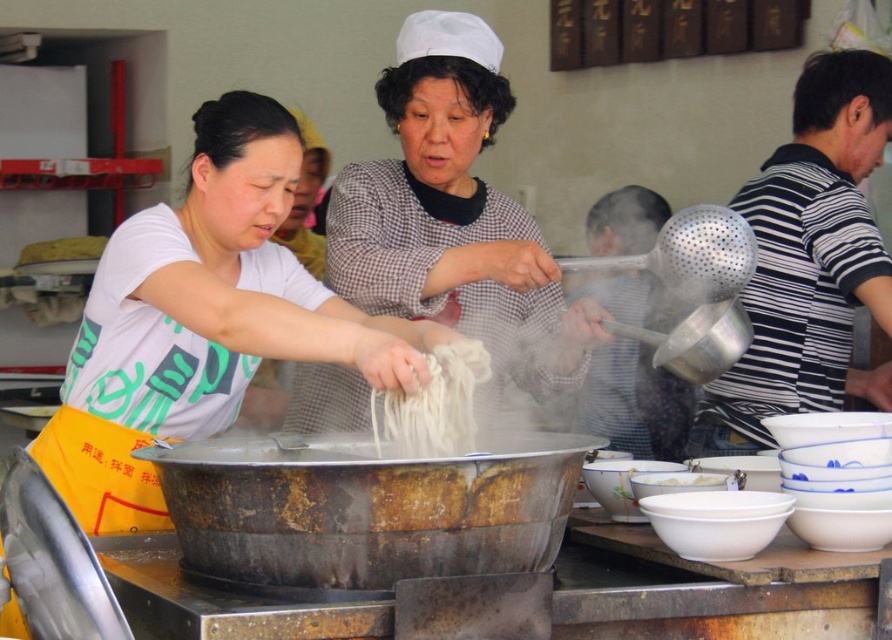
Question: Can you confirm if rusty metal wok at center is smaller than white matte noodles at center?

Choices:
 (A) no
 (B) yes

Answer: (A)

Question: Which of the following is the farthest from the observer?

Choices:
 (A) matte white shirt at center
 (B) checkered fabric shirt at center
 (C) white matte noodles at center

Answer: (B)

Question: Does matte white shirt at center appear over white matte bowl at lower center?

Choices:
 (A) yes
 (B) no

Answer: (A)

Question: Which of the following is the closest to the observer?

Choices:
 (A) rusty metal wok at center
 (B) checkered fabric shirt at center

Answer: (A)

Question: Which of the following is the farthest from the observer?

Choices:
 (A) matte white shirt at center
 (B) white matte bowl at lower center

Answer: (B)

Question: Is the position of matte white shirt at center less distant than that of white matte noodles at center?

Choices:
 (A) yes
 (B) no

Answer: (A)